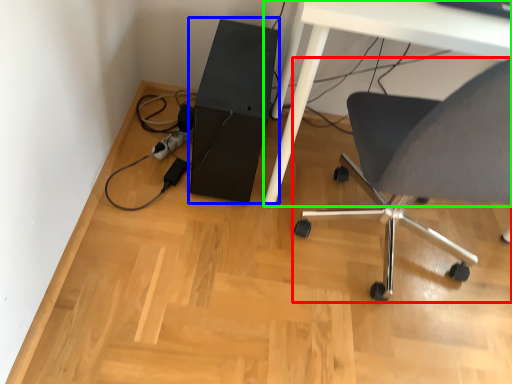
Question: Estimate the real-world distances between objects in this image. Which object is closer to chair (highlighted by a red box), computer tower (highlighted by a blue box) or table (highlighted by a green box)?

Choices:
 (A) computer tower
 (B) table

Answer: (B)